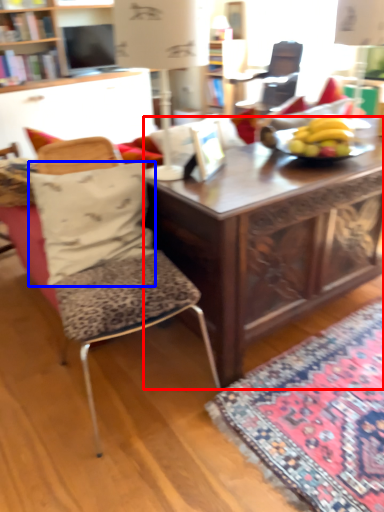
Question: Which object appears closest to the camera in this image, desk (highlighted by a red box) or pillow (highlighted by a blue box)?

Choices:
 (A) desk
 (B) pillow

Answer: (A)